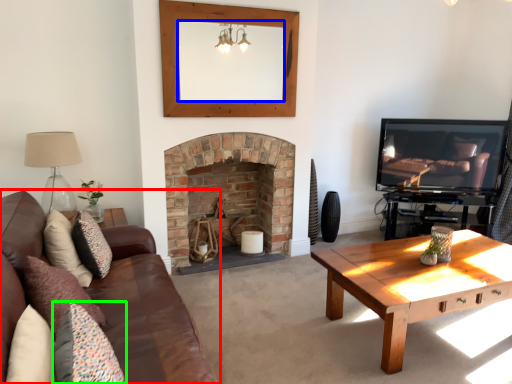
Question: Based on their relative distances, which object is nearer to studio couch (highlighted by a red box)? Choose from mirror (highlighted by a blue box) and pillow (highlighted by a green box).

Choices:
 (A) mirror
 (B) pillow

Answer: (B)